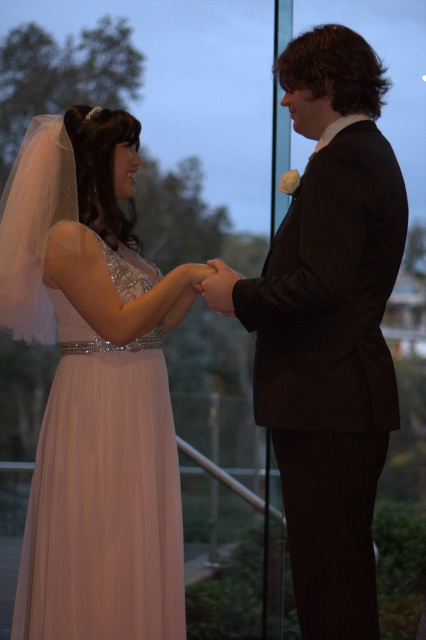
In the scene shown: You are a photographer at the wedding. You need to adjust the lighting to ensure both the satin pink dress at left and the black satin suit at center are well lit. The camera can only focus on one object at a time. Which object should you focus on to ensure both are in the frame?

The distance between the satin pink dress at left and the black satin suit at center is 12.47 inches, so focusing on the black satin suit at center will keep both within the frame since they are close together.

You are a photographer at a wedding. You need to position yourself so that you can capture both the satin pink dress at left and the black satin suit at center in the same frame. Based on their positions, which side should you stand relative to the couple to ensure both are fully visible?

You should stand to the right side of the couple to ensure both the satin pink dress at left and the black satin suit at center are fully visible since the satin pink dress at left is positioned to the left of the black satin suit at center.